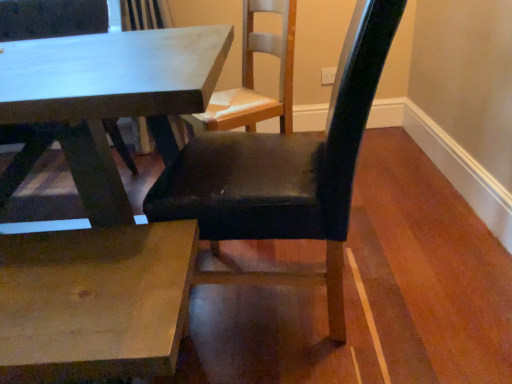
Where is `black leather chair at center`? The image size is (512, 384). black leather chair at center is located at coordinates (285, 171).

Measure the distance between black leather chair at center and camera.

black leather chair at center is 30.31 inches from camera.

Image resolution: width=512 pixels, height=384 pixels. What do you see at coordinates (285, 171) in the screenshot? I see `black leather chair at center` at bounding box center [285, 171].

What is the approximate height of smooth white table at center?

It is 74.04 centimeters.

What do you see at coordinates (108, 95) in the screenshot? The width and height of the screenshot is (512, 384). I see `smooth white table at center` at bounding box center [108, 95].

Identify the location of smooth white table at center. (108, 95).

Where is `black leather chair at center`? This screenshot has height=384, width=512. black leather chair at center is located at coordinates (285, 171).

Visually, is black leather chair at center positioned to the left or to the right of smooth white table at center?

From the image, it's evident that black leather chair at center is to the right of smooth white table at center.

Is the position of black leather chair at center more distant than that of smooth white table at center?

No.

Is point (292, 140) less distant than point (66, 145)?

No.

From the image's perspective, is black leather chair at center beneath smooth white table at center?

Actually, black leather chair at center appears above smooth white table at center in the image.

From a real-world perspective, between black leather chair at center and smooth white table at center, who is vertically lower?

In real-world perspective, smooth white table at center is lower.

Can you confirm if black leather chair at center is wider than smooth white table at center?

In fact, black leather chair at center might be narrower than smooth white table at center.

Considering the relative sizes of black leather chair at center and smooth white table at center in the image provided, is black leather chair at center shorter than smooth white table at center?

No.

Does black leather chair at center have a smaller size compared to smooth white table at center?

Yes, black leather chair at center is smaller than smooth white table at center.

Is black leather chair at center located outside smooth white table at center?

Yes, black leather chair at center is outside of smooth white table at center.

Is black leather chair at center next to smooth white table at center?

black leather chair at center and smooth white table at center are not in contact.

Could you tell me if black leather chair at center is turned towards smooth white table at center?

Yes, black leather chair at center is facing smooth white table at center.

Locate an element on the screen. The width and height of the screenshot is (512, 384). table on the left of black leather chair at center is located at coordinates (108, 95).

Which object is positioned more to the right, smooth white table at center or black leather chair at center?

Positioned to the right is black leather chair at center.

Which object is closer to the camera, smooth white table at center or black leather chair at center?

black leather chair at center is in front.

Which is behind, point (78, 72) or point (175, 191)?

The point (78, 72) is farther.

From the picture: From the image's perspective, is smooth white table at center located above or below black leather chair at center?

Clearly, from the image's perspective, smooth white table at center is below black leather chair at center.

From a real-world perspective, which is physically above, smooth white table at center or black leather chair at center?

black leather chair at center, from a real-world perspective.

Does smooth white table at center have a greater width compared to black leather chair at center?

Indeed, smooth white table at center has a greater width compared to black leather chair at center.

Which of these two, smooth white table at center or black leather chair at center, stands taller?

black leather chair at center is taller.

Considering the relative sizes of smooth white table at center and black leather chair at center in the image provided, is smooth white table at center smaller than black leather chair at center?

No, smooth white table at center is not smaller than black leather chair at center.

Can we say smooth white table at center lies outside black leather chair at center?

smooth white table at center lies outside black leather chair at center's area.

Is smooth white table at center not near black leather chair at center?

No, smooth white table at center is not far from black leather chair at center.

Is black leather chair at center at the back of smooth white table at center?

That's not correct — smooth white table at center is not looking away from black leather chair at center.

What's the angular difference between smooth white table at center and black leather chair at center's facing directions?

The angle between the facing direction of smooth white table at center and the facing direction of black leather chair at center is 91.9 degrees.

In the image, there is a black leather chair at center. Where is `table below it (from a real-world perspective)`? Image resolution: width=512 pixels, height=384 pixels. table below it (from a real-world perspective) is located at coordinates (108, 95).

Image resolution: width=512 pixels, height=384 pixels. I want to click on table lying below the black leather chair at center (from the image's perspective), so click(x=108, y=95).

Image resolution: width=512 pixels, height=384 pixels. Identify the location of chair above the smooth white table at center (from the image's perspective). (285, 171).